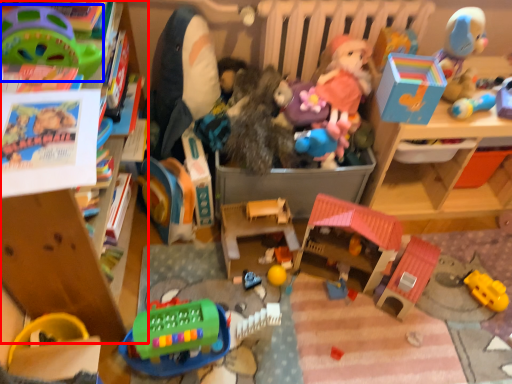
Question: Which of the following is the farthest to the observer, toy (highlighted by a red box) or toy (highlighted by a blue box)?

Choices:
 (A) toy
 (B) toy

Answer: (B)